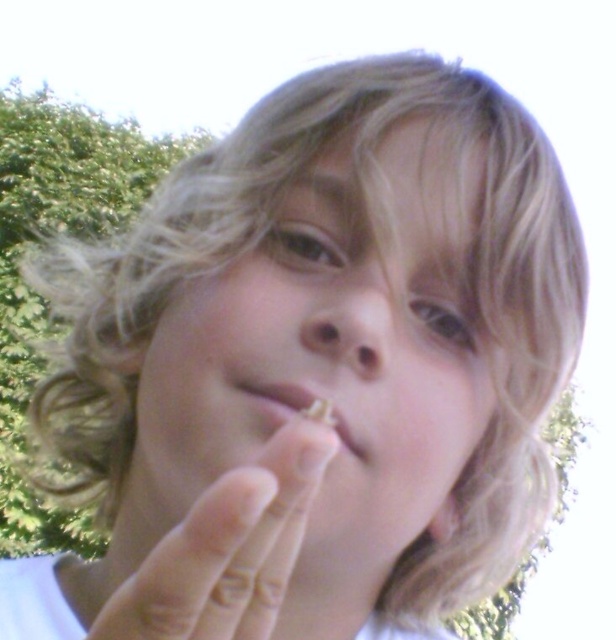
Based on the scene description, can you determine which object occupies more space in the image between the smooth skin face at center and the smooth skin finger at center?

Result: The smooth skin finger at center occupies more space than the smooth skin face at center in the image.

Consider the image. You are a photographer trying to capture a close detail shot of the person holding an object. You want to ensure that the smooth skin finger at center and the matte plastic mouth at center are both in focus. Given that the depth of field can only sharply focus on one of them, which one should you focus on to ensure the larger object is in focus?

You should focus on the smooth skin finger at center because its width is larger than the matte plastic mouth at center, ensuring the larger object is in focus.